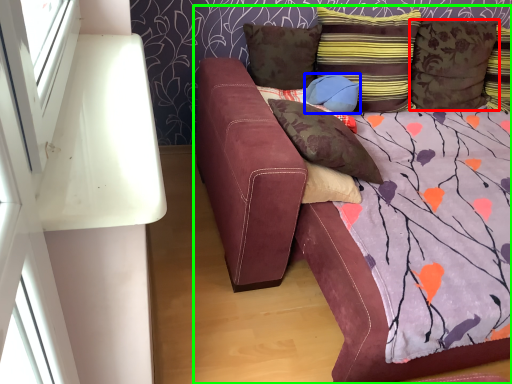
Question: Based on their relative distances, which object is farther from pillow (highlighted by a red box)? Choose from pillow (highlighted by a blue box) and studio couch (highlighted by a green box).

Choices:
 (A) pillow
 (B) studio couch

Answer: (B)